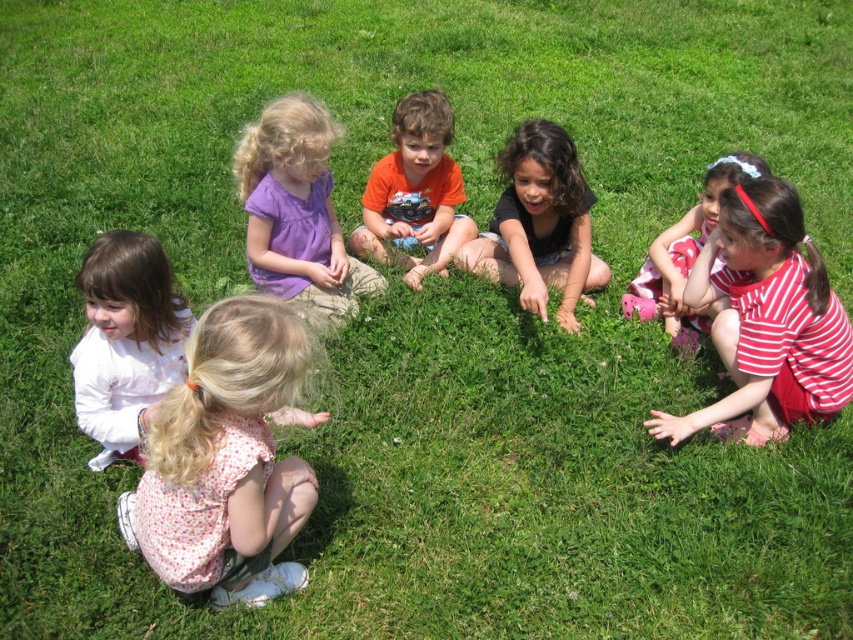
Looking at this image, does floral dress at lower left appear on the right side of striped fabric dress at upper right?

No, floral dress at lower left is not to the right of striped fabric dress at upper right.

This screenshot has width=853, height=640. Describe the element at coordinates (225, 460) in the screenshot. I see `floral dress at lower left` at that location.

Between point (273, 465) and point (671, 300), which one is positioned in front?

Point (273, 465) is in front.

Identify the location of floral dress at lower left. (225, 460).

Based on the photo, does floral dress at lower left appear over orange cotton shirt at center?

No, floral dress at lower left is not above orange cotton shirt at center.

Does floral dress at lower left appear under orange cotton shirt at center?

Yes, floral dress at lower left is below orange cotton shirt at center.

I want to click on floral dress at lower left, so click(225, 460).

I want to click on floral dress at lower left, so click(225, 460).

Can you confirm if striped cotton dress at lower right is wider than striped fabric dress at upper right?

Yes.

Who is more forward, (815, 416) or (653, 262)?

Point (815, 416) is more forward.

Locate an element on the screen. striped cotton dress at lower right is located at coordinates point(766,321).